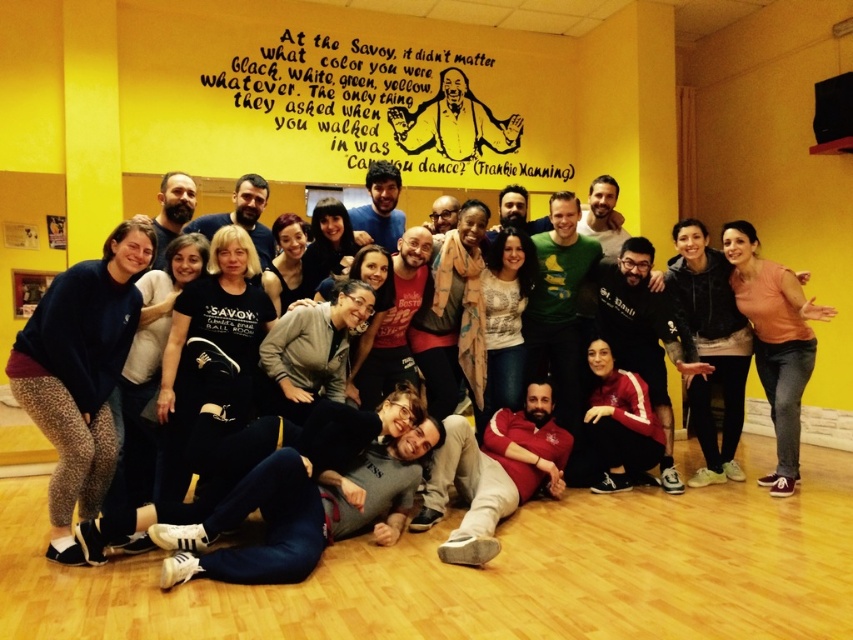
Question: Does orange cotton shirt at right have a greater width compared to matte black jacket at center?

Choices:
 (A) no
 (B) yes

Answer: (A)

Question: Does dark blue fleece at lower left have a lesser width compared to orange cotton shirt at right?

Choices:
 (A) yes
 (B) no

Answer: (B)

Question: Is dark blue fleece at lower left to the right of matte black t-shirt at center from the viewer's perspective?

Choices:
 (A) yes
 (B) no

Answer: (B)

Question: Which point appears closest to the camera in this image?

Choices:
 (A) (775, 484)
 (B) (67, 422)
 (C) (4, 193)
 (D) (236, 196)

Answer: (B)

Question: Which of the following is the farthest from the observer?

Choices:
 (A) matte black t-shirt at center
 (B) orange cotton shirt at right
 (C) matte black jacket at center

Answer: (C)

Question: Which of these objects is positioned farthest from the dark blue fleece at lower left?

Choices:
 (A) matte black t-shirt at center
 (B) orange cotton shirt at right
 (C) matte black jacket at center

Answer: (B)